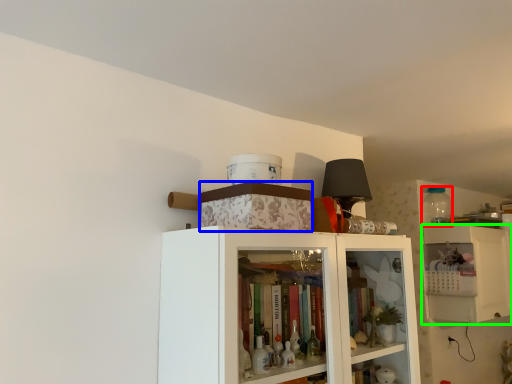
Question: Estimate the real-world distances between objects in this image. Which object is farther from bottle (highlighted by a red box), box (highlighted by a blue box) or cabinetry (highlighted by a green box)?

Choices:
 (A) box
 (B) cabinetry

Answer: (A)